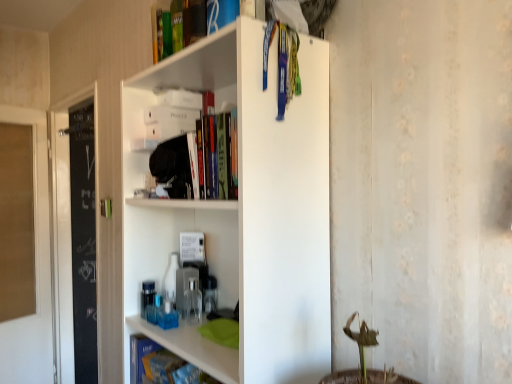
Question: Looking at their shapes, would you say blue matte book at lower left, which is counted as the second book, starting from the bottom, is wider or thinner than white matte shelf at upper center?

Choices:
 (A) wide
 (B) thin

Answer: (B)

Question: From the image's perspective, is blue matte book at lower left, which is counted as the second book, starting from the bottom, located above or below white matte shelf at upper center?

Choices:
 (A) above
 (B) below

Answer: (B)

Question: Which object is the closest to the blue matte book at lower left, the second book positioned from the top?

Choices:
 (A) blue matte book at lower left, positioned as the 3th book in top-to-bottom order
 (B) white matte shelf at upper center
 (C) transparent glass door at left
 (D) green matte book at upper center, the 3th book positioned from the bottom

Answer: (A)

Question: Which object is positioned farthest from the green matte book at upper center, placed as the first book when sorted from top to bottom?

Choices:
 (A) white matte shelf at upper center
 (B) transparent glass door at left
 (C) blue matte book at lower left, which is counted as the second book, starting from the bottom
 (D) blue matte book at lower left, positioned as the 3th book in top-to-bottom order

Answer: (B)